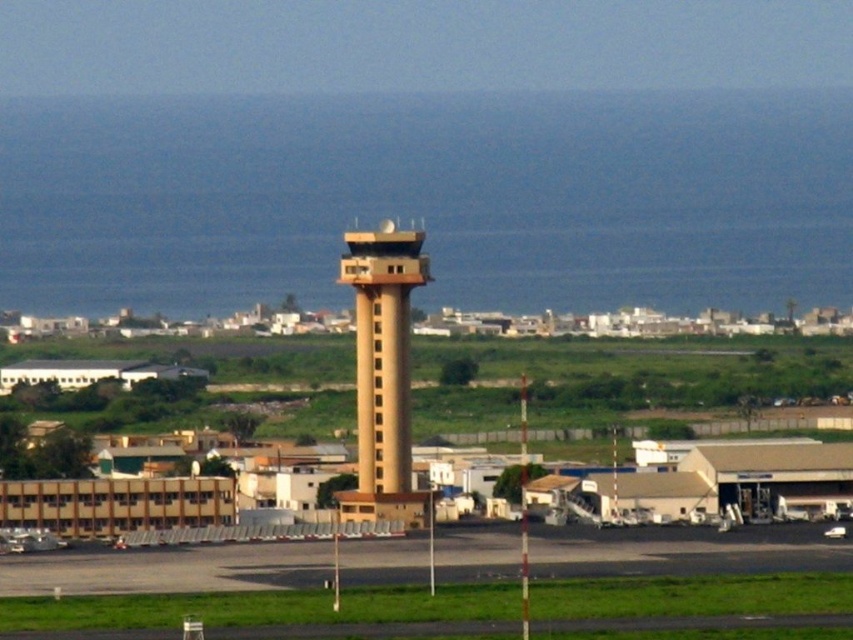
Is the position of black asphalt runway at lower center less distant than that of tan concrete control tower at center?

No, it is not.

Can you confirm if black asphalt runway at lower center is thinner than tan concrete control tower at center?

In fact, black asphalt runway at lower center might be wider than tan concrete control tower at center.

Find the location of a particular element. black asphalt runway at lower center is located at coordinates (685, 550).